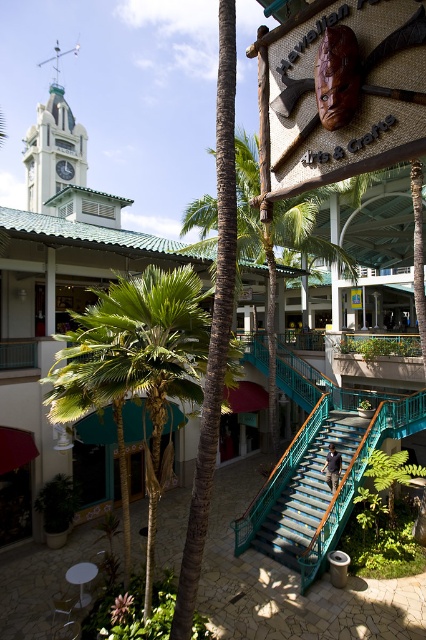
Question: In this image, where is green leafy palm tree at center located relative to teal metal stairs at center?

Choices:
 (A) above
 (B) below

Answer: (A)

Question: Estimate the real-world distances between objects in this image. Which object is closer to the metallic clock at upper left?

Choices:
 (A) green painted metal clock tower at upper left
 (B) teal metal stairs at center
 (C) green leafy palm tree at center

Answer: (A)

Question: Which point is closer to the camera?

Choices:
 (A) green painted metal clock tower at upper left
 (B) green leafy palm tree at center

Answer: (B)

Question: Is green leafy palm tree at center below teal metal stairs at center?

Choices:
 (A) no
 (B) yes

Answer: (A)

Question: Which point is closer to the camera?

Choices:
 (A) (85, 168)
 (B) (150, 508)
 (C) (72, 170)
 (D) (310, 508)

Answer: (B)

Question: Is teal metal stairs at center smaller than metallic clock at upper left?

Choices:
 (A) no
 (B) yes

Answer: (A)